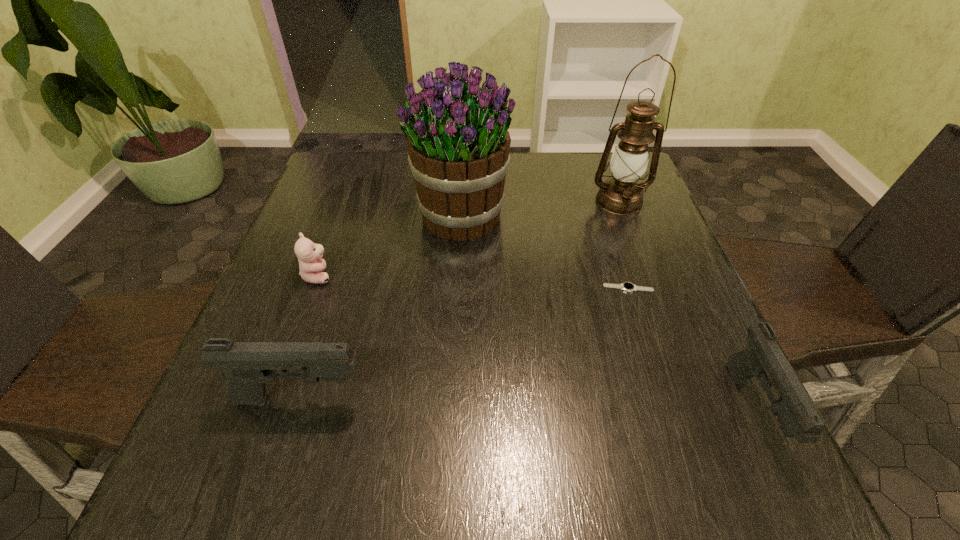
Find the location of `blank region between the shortest object and the rightmost object`. blank region between the shortest object and the rightmost object is located at coordinates (690, 349).

Identify the location of vacant area that lies between the watch and the oil lamp. The image size is (960, 540). (624, 245).

The image size is (960, 540). I want to click on free space between the watch and the second shortest object, so click(473, 282).

At what (x,y) coordinates should I click in order to perform the action: click on unoccupied area between the third tallest object and the fifth tallest object. Please return your answer as a coordinate pair (x, y). This screenshot has width=960, height=540. Looking at the image, I should click on (310, 337).

Image resolution: width=960 pixels, height=540 pixels. In order to click on free spot between the third tallest object and the right pistol in this screenshot , I will do `click(527, 404)`.

You are a GUI agent. You are given a task and a screenshot of the screen. Output one action in this format:
    pyautogui.click(x=<x>, y=<y>)
    Task: Click on the vacant point located between the shortest object and the bouquet
    This screenshot has width=960, height=540.
    Given the screenshot: What is the action you would take?
    pyautogui.click(x=545, y=252)

Where is `free space between the fourth tallest object and the watch`? This screenshot has width=960, height=540. free space between the fourth tallest object and the watch is located at coordinates (690, 349).

Find the location of a particular element. This screenshot has width=960, height=540. object identified as the third closest to the second shortest object is located at coordinates (629, 287).

Locate an element on the screen. This screenshot has height=540, width=960. the closest object to the bouquet is located at coordinates (311, 266).

The width and height of the screenshot is (960, 540). Find the location of `vacant area that satisfies the following two spatial constraints: 1. on the front side of the oil lamp; 2. at the face of the teddy bear`. vacant area that satisfies the following two spatial constraints: 1. on the front side of the oil lamp; 2. at the face of the teddy bear is located at coordinates (647, 275).